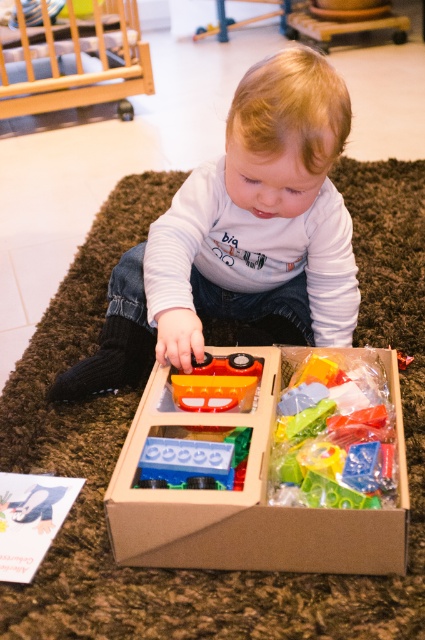
Question: Is smooth white shirt at center to the right of translucent orange plastic toy car at center from the viewer's perspective?

Choices:
 (A) yes
 (B) no

Answer: (A)

Question: Which of the following is the closest to the observer?

Choices:
 (A) (365, 554)
 (B) (218, 381)
 (C) (294, 100)
 (D) (374, 380)

Answer: (A)

Question: Which point appears farthest from the camera in this image?

Choices:
 (A) (249, 397)
 (B) (374, 552)
 (C) (243, 284)

Answer: (C)

Question: Considering the relative positions of smooth white shirt at center and translucent plastic toy at center in the image provided, where is smooth white shirt at center located with respect to translucent plastic toy at center?

Choices:
 (A) right
 (B) left

Answer: (B)

Question: Does brown cardboard box at center appear over translucent orange plastic toy car at center?

Choices:
 (A) yes
 (B) no

Answer: (B)

Question: Which point appears farthest from the camera in this image?

Choices:
 (A) tap(379, 545)
 (B) tap(212, 396)

Answer: (B)